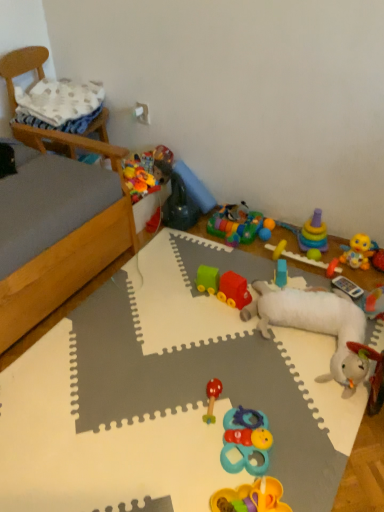
Locate an element on the screen. The image size is (384, 512). free space above wooden table at center (from a real-world perspective) is located at coordinates (177, 377).